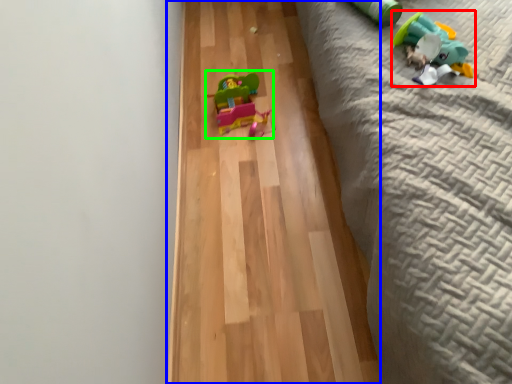
Question: Which is farther away from toy (highlighted by a red box)? hardwood (highlighted by a blue box) or toy (highlighted by a green box)?

Choices:
 (A) hardwood
 (B) toy

Answer: (B)